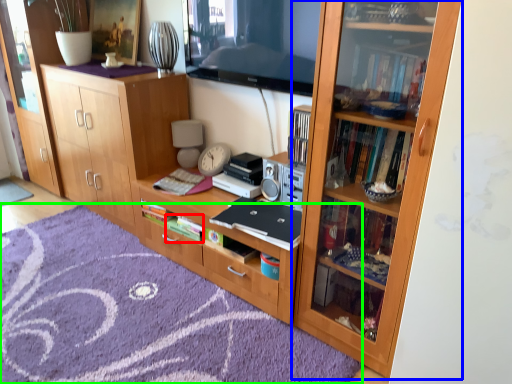
Question: Which object is positioned farthest from book (highlighted by a red box)? Select from bookcase (highlighted by a blue box) and doormat (highlighted by a green box).

Choices:
 (A) bookcase
 (B) doormat

Answer: (A)